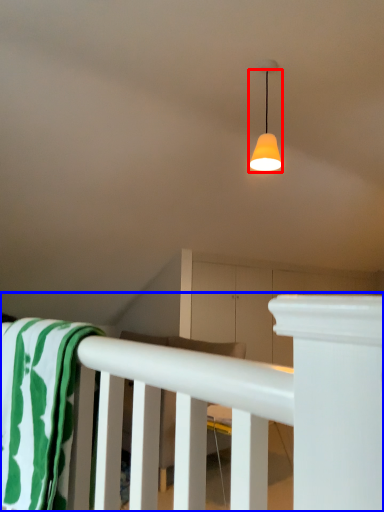
Question: Which of the following is the closest to the observer, lamp (highlighted by a red box) or rail (highlighted by a blue box)?

Choices:
 (A) lamp
 (B) rail

Answer: (B)